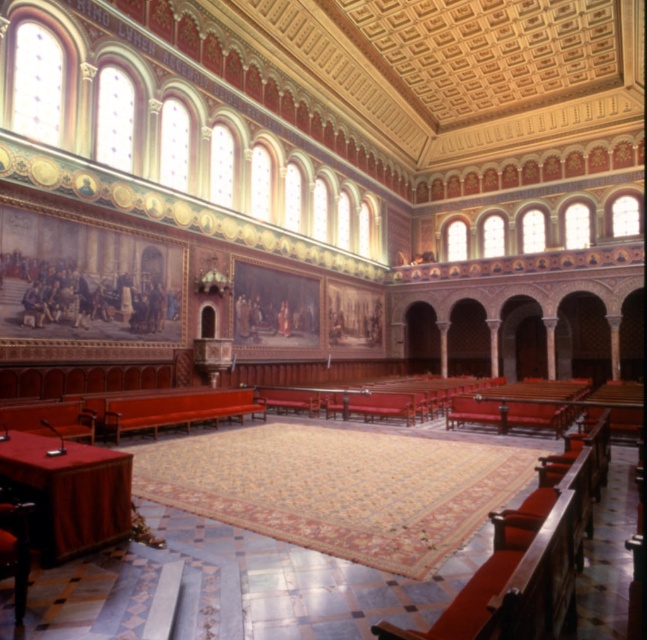
You are standing in the ornate interior space and need to find the metallic polished chair at lower left. According to the coordinates provided, where exactly is it positioned?

The metallic polished chair at lower left is located at point (x=14, y=545), which means it is positioned near the lower left corner of the space based on the coordinate system provided.

You are a visitor in this ornate hall and want to sit down. You see the matte red bench at center and the metallic polished chair at lower left. Which one is taller?

The matte red bench at center is taller than the metallic polished chair at lower left.